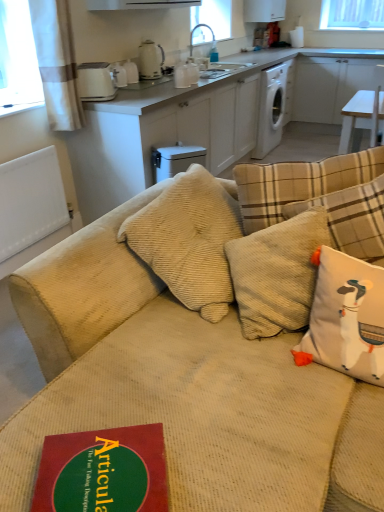
Question: Is white ceramic kettle at upper center, positioned as the third appliance in right-to-left order, at the left side of beige corduroy couch at center?

Choices:
 (A) no
 (B) yes

Answer: (B)

Question: Does white ceramic kettle at upper center, positioned as the third appliance in right-to-left order, have a greater width compared to beige corduroy couch at center?

Choices:
 (A) no
 (B) yes

Answer: (A)

Question: Are white ceramic kettle at upper center, positioned as the third appliance in right-to-left order, and beige corduroy couch at center located far from each other?

Choices:
 (A) no
 (B) yes

Answer: (B)

Question: Is white ceramic kettle at upper center, the second appliance from the left, further to the viewer compared to beige corduroy couch at center?

Choices:
 (A) no
 (B) yes

Answer: (B)

Question: Can you confirm if white ceramic kettle at upper center, positioned as the third appliance in right-to-left order, is smaller than beige corduroy couch at center?

Choices:
 (A) no
 (B) yes

Answer: (B)

Question: Is white ceramic kettle at upper center, the second appliance from the left, in front of or behind red matte paper at lower left in the image?

Choices:
 (A) front
 (B) behind

Answer: (B)

Question: Based on their positions, is white ceramic kettle at upper center, positioned as the third appliance in right-to-left order, located to the left or right of red matte paper at lower left?

Choices:
 (A) right
 (B) left

Answer: (B)

Question: From a real-world perspective, relative to red matte paper at lower left, is white ceramic kettle at upper center, positioned as the third appliance in right-to-left order, vertically above or below?

Choices:
 (A) below
 (B) above

Answer: (B)

Question: Is white ceramic kettle at upper center, the second appliance from the left, situated inside red matte paper at lower left or outside?

Choices:
 (A) outside
 (B) inside

Answer: (A)

Question: Based on their positions, is beige corduroy couch at center located to the left or right of white glossy electric kettle at upper center, the second appliance viewed from the right?

Choices:
 (A) left
 (B) right

Answer: (B)

Question: Considering the positions of beige corduroy couch at center and white glossy electric kettle at upper center, acting as the 3th appliance starting from the left, in the image, is beige corduroy couch at center bigger or smaller than white glossy electric kettle at upper center, acting as the 3th appliance starting from the left,?

Choices:
 (A) small
 (B) big

Answer: (B)

Question: Is point [160, 361] positioned closer to the camera than point [162, 48]?

Choices:
 (A) farther
 (B) closer

Answer: (B)

Question: From the image's perspective, is beige corduroy couch at center located above or below white glossy electric kettle at upper center, the second appliance viewed from the right?

Choices:
 (A) above
 (B) below

Answer: (B)

Question: From the image's perspective, relative to white textured curtain at upper left, is white plastic dishwasher at center above or below?

Choices:
 (A) below
 (B) above

Answer: (A)

Question: Based on their sizes in the image, would you say white plastic dishwasher at center is bigger or smaller than white textured curtain at upper left?

Choices:
 (A) small
 (B) big

Answer: (A)